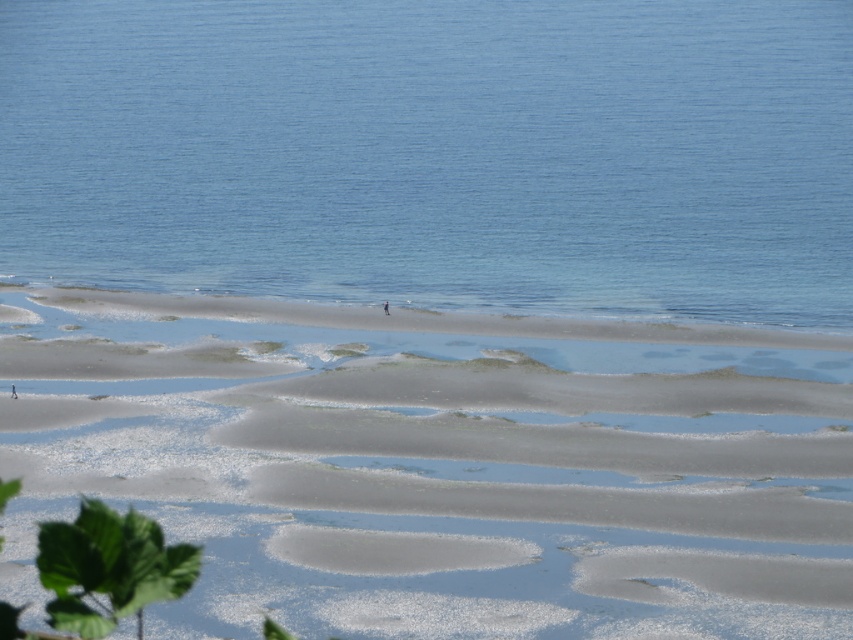
Between point (509, 102) and point (608, 548), which one is positioned behind?

The point (509, 102) is more distant.

Who is higher up, clear blue water at center or sandy at lower center?

clear blue water at center

Which is in front, point (367, 157) or point (625, 412)?

Point (625, 412)

Identify the location of clear blue water at center. This screenshot has width=853, height=640. [x=437, y=154].